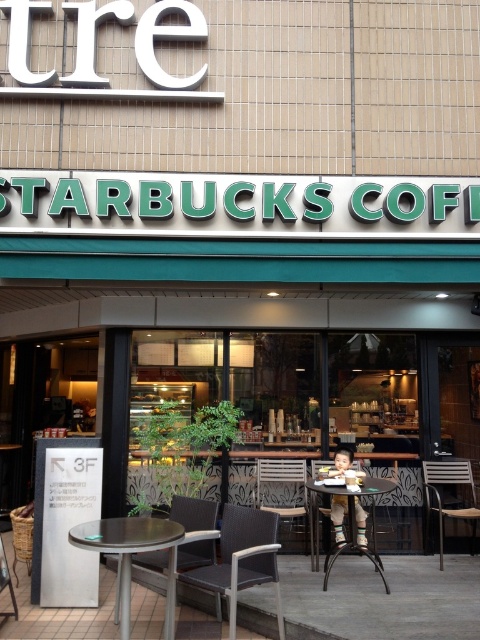
You are a customer entering the Starbucks Coffee shop and need to sit down. You see a metallic gray table at lower left and a metallic gray chair at lower left. Which one should you sit on?

The metallic gray chair at lower left is the one you should sit on because it has a lower height compared to the metallic gray table at lower left.

Based on the photo, you are standing in front of the Starbucks Coffee shop entrance. You see two points marked on the facade. The first point is at coordinate point (165, 552) and the second is at point (367, 481). Which point is closer to you?

Point (165, 552) is closer to the camera than point (367, 481), so the first point is closer to you.

You are a customer entering the Starbucks Coffee shop and want to sit down. You see a dark brown woven chair at center and a metallic wicker chair at lower center. Which chair is located above the other?

The dark brown woven chair at center is positioned under the metallic wicker chair at lower center, so the metallic wicker chair at lower center is above the dark brown woven chair at center.